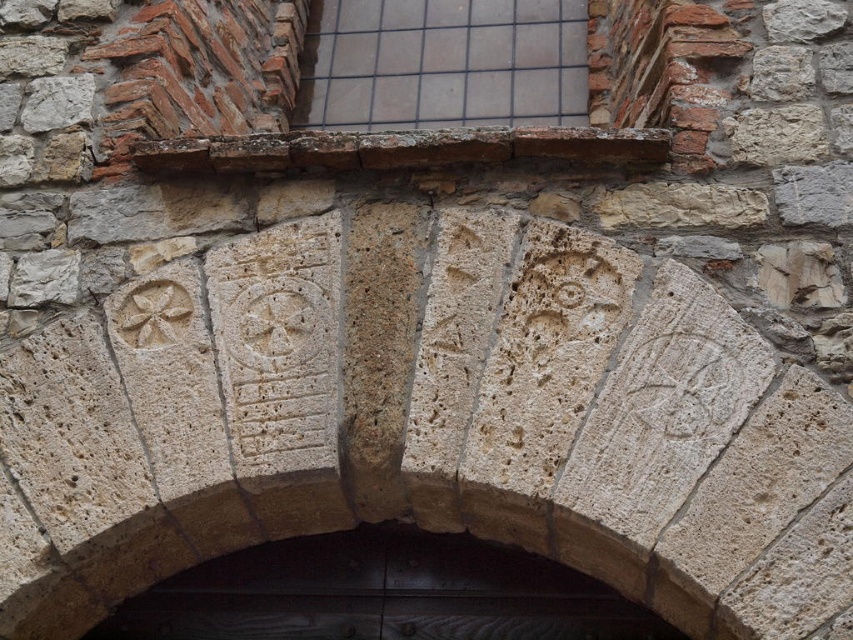
You are an architect designing a new building and want to ensure the door and window proportions match the historical style. The dark wood door at center is wider than the clear glass window at upper center. Which object has a greater width?

The dark wood door at center has a greater width than the clear glass window at upper center according to the description.

You are standing in front of an ancient stone structure and notice two points marked on the wall. The first point is at coordinate [592,602] and the second is at [334,44]. Which point is closer to you?

Point [592,602] is closer to the viewer than point [334,44].

Based on the photo, you are an architect examining the ancient stone structure. You need to determine if the dark wood door at center can fit through the clear glass window at upper center. Can it vertically?

The dark wood door at center is shorter than the clear glass window at upper center, so it can fit vertically through the window.